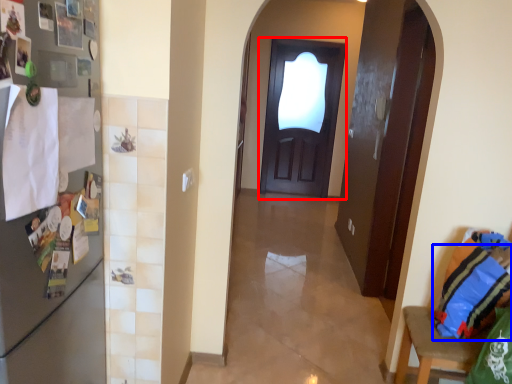
Question: Which object appears closest to the camera in this image, door (highlighted by a red box) or pillow (highlighted by a blue box)?

Choices:
 (A) door
 (B) pillow

Answer: (B)